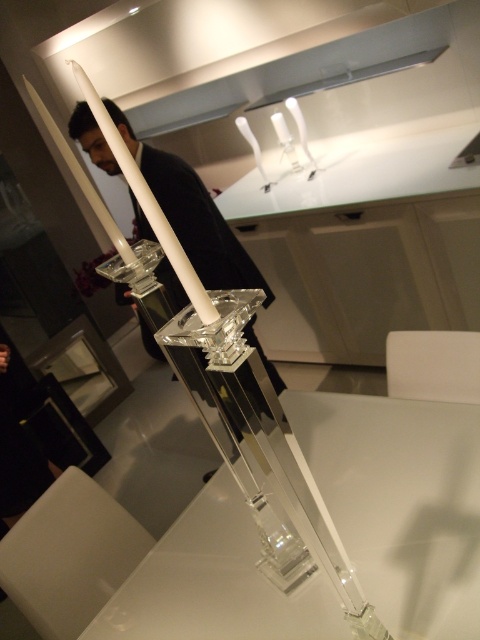
Question: Which point is closer to the camera?

Choices:
 (A) matte black suit at center
 (B) clear acrylic table at center
 (C) white glossy exhaust hood at upper center

Answer: (B)

Question: Which is farther from the matte black suit at center?

Choices:
 (A) clear acrylic table at center
 (B) white glossy exhaust hood at upper center

Answer: (B)

Question: Can you confirm if matte black suit at center is positioned below white glossy exhaust hood at upper center?

Choices:
 (A) no
 (B) yes

Answer: (B)

Question: Considering the relative positions of clear acrylic table at center and matte black suit at center in the image provided, where is clear acrylic table at center located with respect to matte black suit at center?

Choices:
 (A) left
 (B) right

Answer: (B)

Question: Which object appears farthest from the camera in this image?

Choices:
 (A) clear acrylic table at center
 (B) matte black suit at center
 (C) white glossy exhaust hood at upper center

Answer: (C)

Question: Can you confirm if clear acrylic table at center is smaller than matte black suit at center?

Choices:
 (A) no
 (B) yes

Answer: (B)